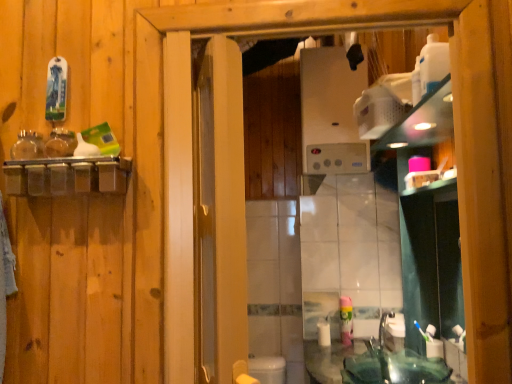
Question: From a real-world perspective, is satin silver boiler at upper center on top of green glass sink at lower right?

Choices:
 (A) yes
 (B) no

Answer: (A)

Question: From a real-world perspective, is satin silver boiler at upper center physically below green glass sink at lower right?

Choices:
 (A) yes
 (B) no

Answer: (B)

Question: Is satin silver boiler at upper center positioned with its back to green glass sink at lower right?

Choices:
 (A) yes
 (B) no

Answer: (B)

Question: Would you say satin silver boiler at upper center is outside green glass sink at lower right?

Choices:
 (A) yes
 (B) no

Answer: (A)

Question: From the image's perspective, is satin silver boiler at upper center located above green glass sink at lower right?

Choices:
 (A) yes
 (B) no

Answer: (A)

Question: Considering the relative sizes of satin silver boiler at upper center and green glass sink at lower right in the image provided, is satin silver boiler at upper center shorter than green glass sink at lower right?

Choices:
 (A) yes
 (B) no

Answer: (B)

Question: Is white matte toilet paper at lower center facing away from green plastic mouthwash at lower right?

Choices:
 (A) no
 (B) yes

Answer: (B)

Question: From a real-world perspective, is white matte toilet paper at lower center physically below green plastic mouthwash at lower right?

Choices:
 (A) yes
 (B) no

Answer: (A)

Question: Is green plastic mouthwash at lower right a part of white matte toilet paper at lower center?

Choices:
 (A) yes
 (B) no

Answer: (B)

Question: Is white matte toilet paper at lower center next to green plastic mouthwash at lower right and touching it?

Choices:
 (A) yes
 (B) no

Answer: (B)

Question: Is white matte toilet paper at lower center thinner than green plastic mouthwash at lower right?

Choices:
 (A) yes
 (B) no

Answer: (B)

Question: From the image's perspective, is white matte toilet paper at lower center under green plastic mouthwash at lower right?

Choices:
 (A) yes
 (B) no

Answer: (A)

Question: From a real-world perspective, is white plastic toothbrush at lower right physically above green glass sink at lower right?

Choices:
 (A) no
 (B) yes

Answer: (B)